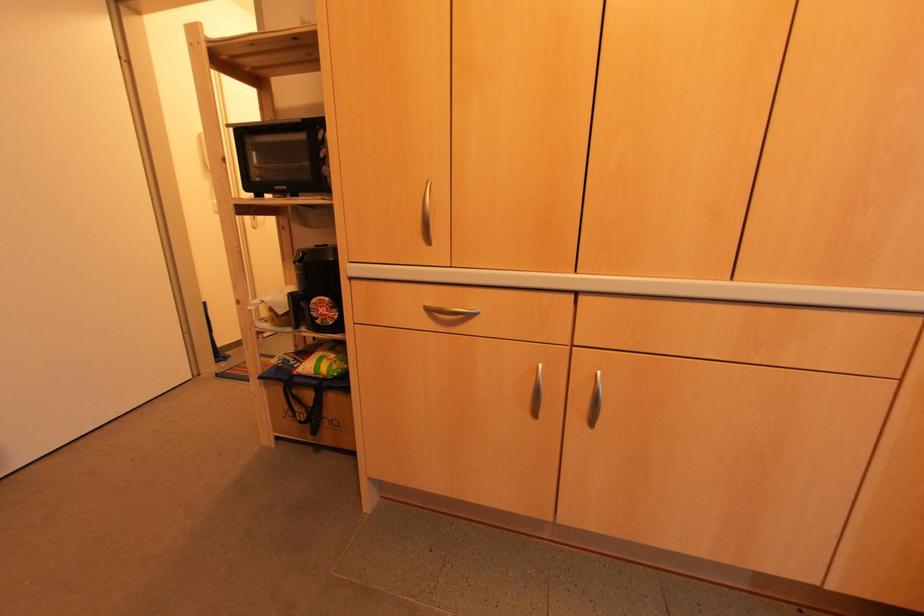
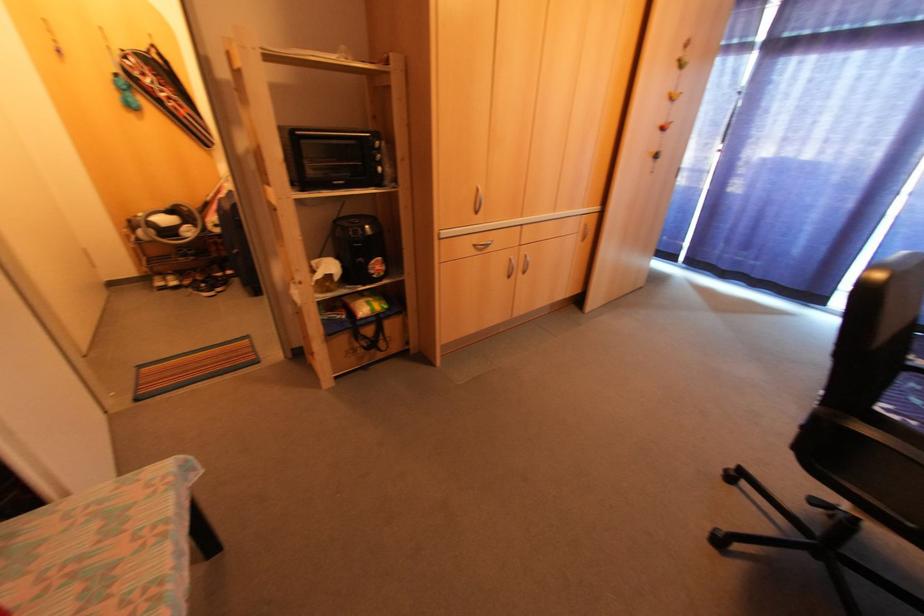
Find the pixel in the second image that matches the point at 532,414 in the first image.

(506, 277)